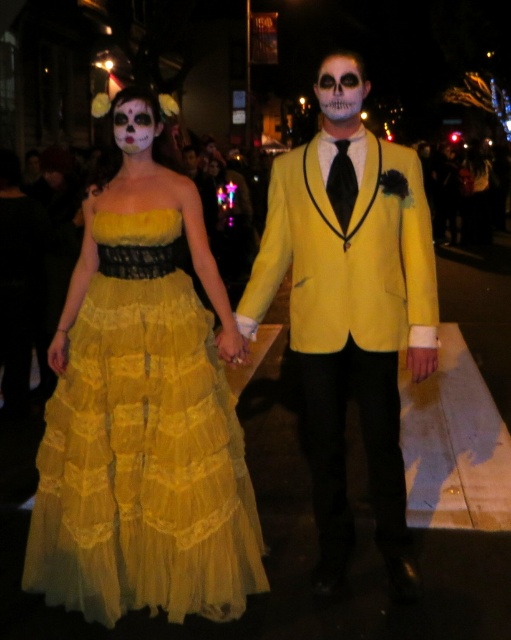
Question: Considering the real-world distances, which object is closest to the matte white face at upper left?

Choices:
 (A) matte yellow suit at center
 (B) yellow tulle dress at center
 (C) matte yellow dress at center

Answer: (C)

Question: Which is nearer to the matte white face at upper left?

Choices:
 (A) matte yellow suit at center
 (B) white painted skull at center
 (C) yellow tulle dress at center

Answer: (B)

Question: Is matte yellow dress at center closer to camera compared to yellow tulle dress at center?

Choices:
 (A) yes
 (B) no

Answer: (A)

Question: Can you confirm if matte yellow dress at center is positioned above white painted skull at center?

Choices:
 (A) no
 (B) yes

Answer: (A)

Question: Which object appears closest to the camera in this image?

Choices:
 (A) matte yellow dress at center
 (B) white painted skull at center

Answer: (A)

Question: Observing the image, what is the correct spatial positioning of matte yellow dress at center in reference to matte yellow suit at center?

Choices:
 (A) right
 (B) left

Answer: (B)